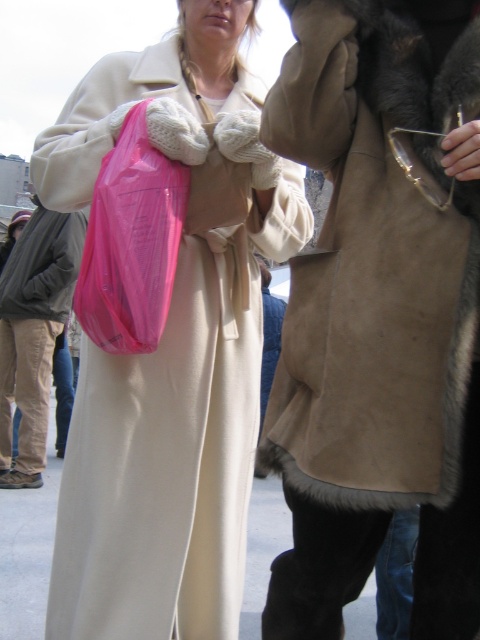
Question: Does suede fur coat at right have a larger size compared to matte beige coat at lower left?

Choices:
 (A) no
 (B) yes

Answer: (B)

Question: Considering the relative positions of suede fur coat at right and pink plastic bag at center in the image provided, where is suede fur coat at right located with respect to pink plastic bag at center?

Choices:
 (A) above
 (B) below

Answer: (B)

Question: Which object is farther from the camera taking this photo?

Choices:
 (A) matte beige coat at lower left
 (B) suede fur coat at right

Answer: (A)

Question: Among these points, which one is farthest from the camera?

Choices:
 (A) (463, 364)
 (B) (122, 227)
 (C) (261, 144)
 (D) (38, 380)

Answer: (D)

Question: Which of the following is the farthest from the observer?

Choices:
 (A) matte beige coat at lower left
 (B) suede fur coat at right
 (C) matte plastic bag at center

Answer: (A)

Question: In this image, where is matte plastic bag at center located relative to suede fur coat at right?

Choices:
 (A) right
 (B) left

Answer: (B)